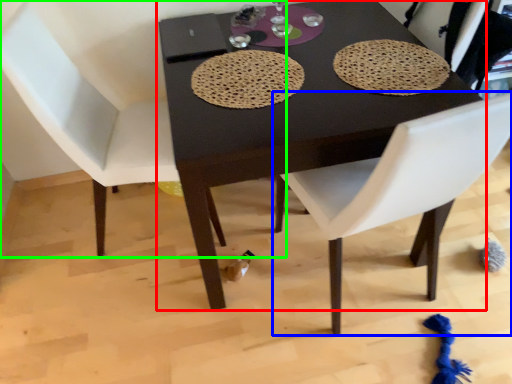
Question: Which object is the closest to the table (highlighted by a red box)? Choose among these: chair (highlighted by a blue box) or chair (highlighted by a green box).

Choices:
 (A) chair
 (B) chair

Answer: (A)